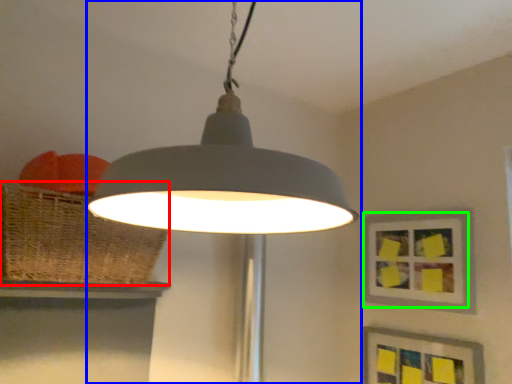
Question: Based on their relative distances, which object is farther from basket (highlighted by a red box)? Choose from lamp (highlighted by a blue box) and picture frame (highlighted by a green box).

Choices:
 (A) lamp
 (B) picture frame

Answer: (B)